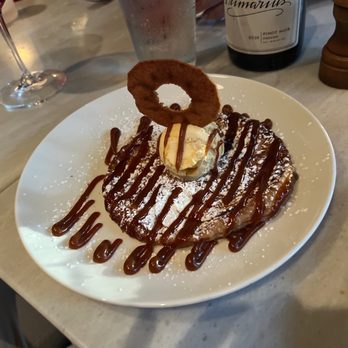
Locate an element on the screen. The width and height of the screenshot is (348, 348). part of wineglass you would hold is located at coordinates (16, 50).